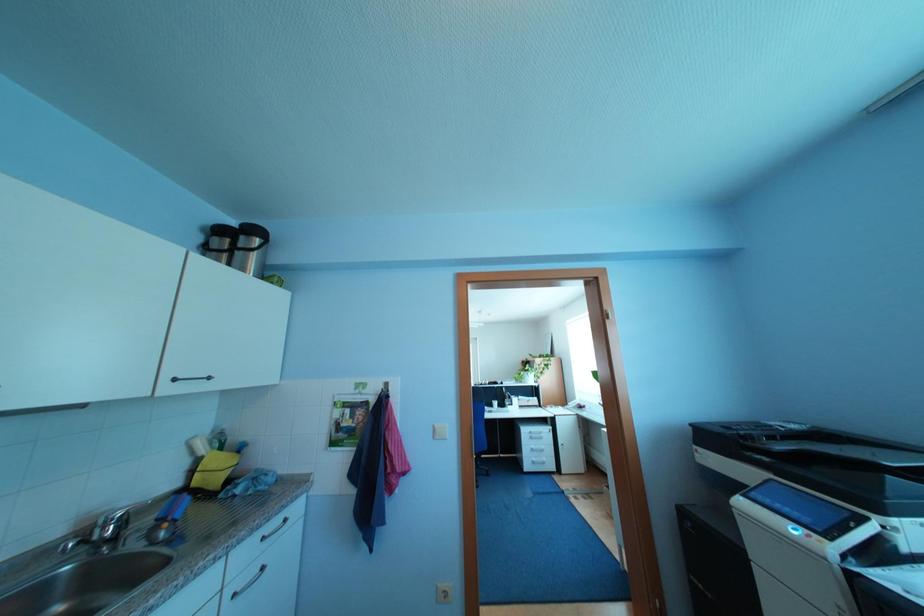
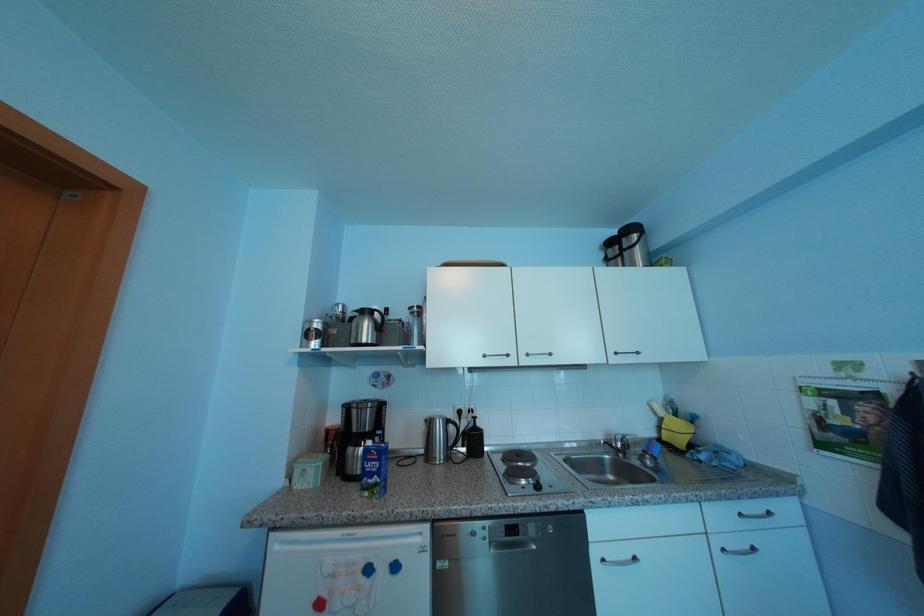
Question: The first image is from the beginning of the video and the second image is from the end. How did the camera likely rotate when shooting the video?

Choices:
 (A) Left
 (B) Right
 (C) Up
 (D) Down

Answer: (A)